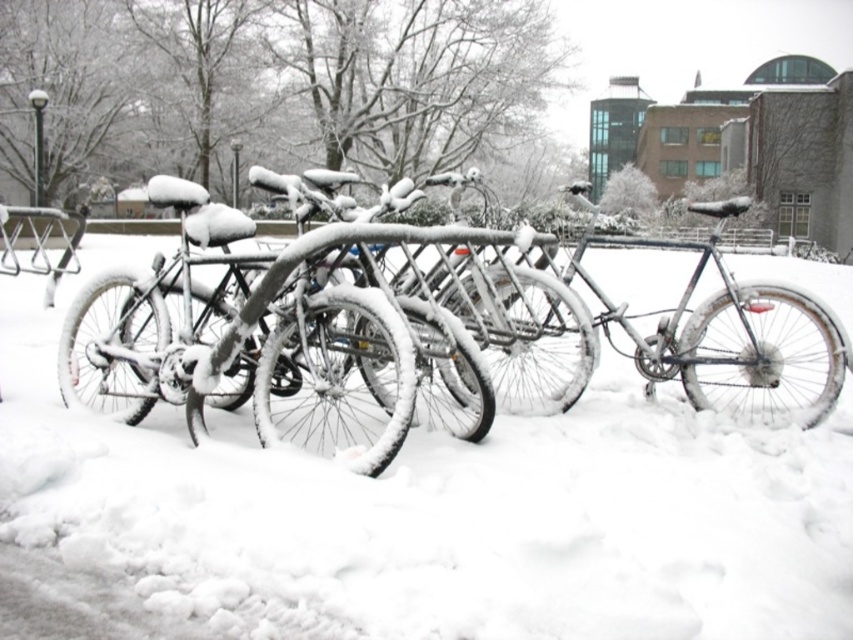
You are standing at the origin point of the coordinate system in the snowy scene. You want to walk to the white fluffy snow at center. Which direction should you move in to reach it?

To reach the white fluffy snow at center located at coordinate point (434, 512), you should move in the direction of increasing x and y coordinates from the origin point.

You are standing in the snowy area and want to move from the white fluffy snow at center to the shiny silver bicycle at center. Which direction should you move to reach the bicycle?

You should move to the right because the white fluffy snow at center is to the left of the shiny silver bicycle at center.